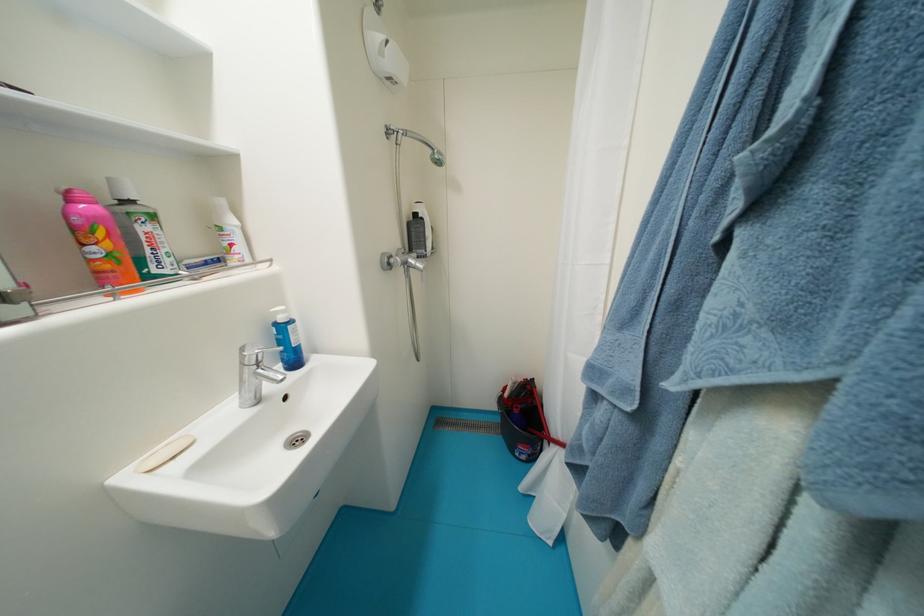
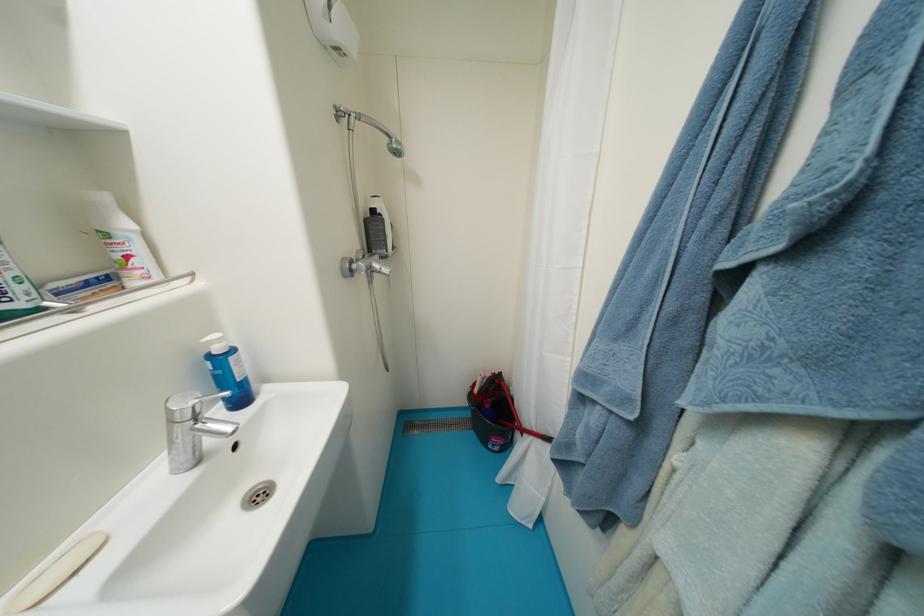
Locate, in the second image, the point that corresponds to [193,264] in the first image.

(61, 286)